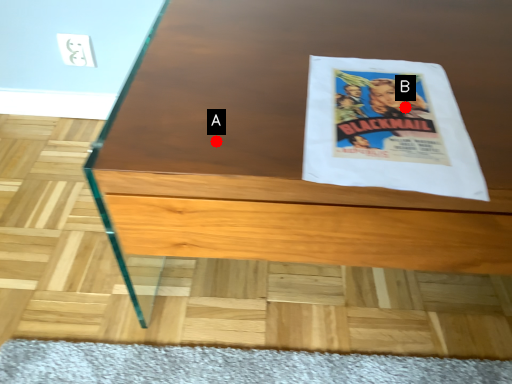
Question: Two points are circled on the image, labeled by A and B beside each circle. Which point is further to the camera?

Choices:
 (A) A is further
 (B) B is further

Answer: (B)